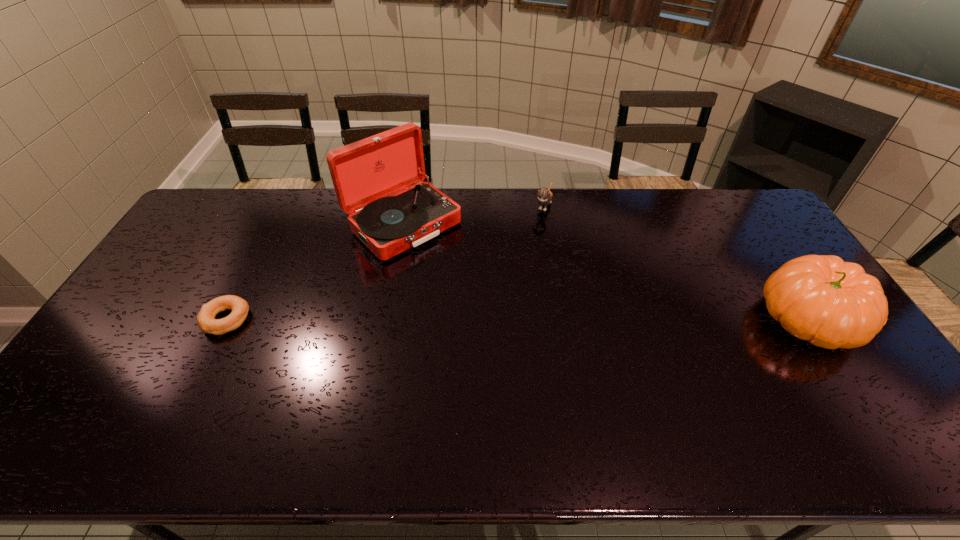
The height and width of the screenshot is (540, 960). I want to click on vacant point located between the third object from right to left and the pumpkin, so click(x=606, y=272).

At what (x,y) coordinates should I click in order to perform the action: click on empty space between the third object from right to left and the leftmost object. Please return your answer as a coordinate pair (x, y). Image resolution: width=960 pixels, height=540 pixels. Looking at the image, I should click on (315, 272).

You are a GUI agent. You are given a task and a screenshot of the screen. Output one action in this format:
    pyautogui.click(x=<x>, y=<y>)
    Task: Click on the free spot between the bagel and the kitten
    
    Given the screenshot: What is the action you would take?
    pyautogui.click(x=385, y=262)

Locate an element on the screen. object that ranks as the closest to the tallest object is located at coordinates (206, 320).

I want to click on object that is the third closest to the shortest object, so click(x=832, y=304).

You are a GUI agent. You are given a task and a screenshot of the screen. Output one action in this format:
    pyautogui.click(x=<x>, y=<y>)
    Task: Click on the vacant space that satisfies the following two spatial constraints: 1. on the front side of the third shortest object; 2. on the carved face of the third object from right to left
    This screenshot has width=960, height=540.
    Given the screenshot: What is the action you would take?
    pyautogui.click(x=385, y=319)

Image resolution: width=960 pixels, height=540 pixels. In order to click on free space that satisfies the following two spatial constraints: 1. on the back side of the leftmost object; 2. on the carved face of the pumpkin in this screenshot , I will do `click(227, 319)`.

The height and width of the screenshot is (540, 960). I want to click on vacant region that satisfies the following two spatial constraints: 1. on the back side of the phonograph_record; 2. on the left side of the kitten, so pyautogui.click(x=407, y=205).